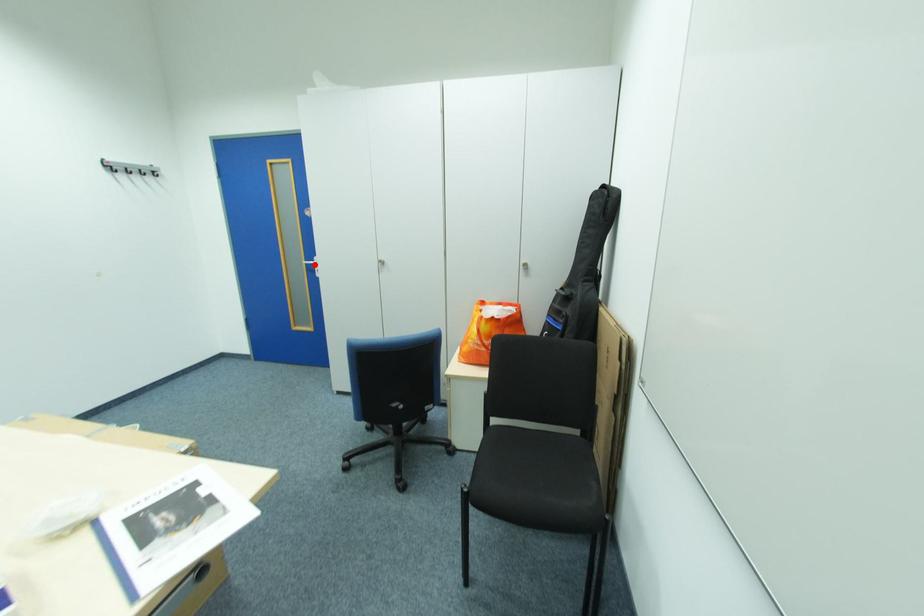
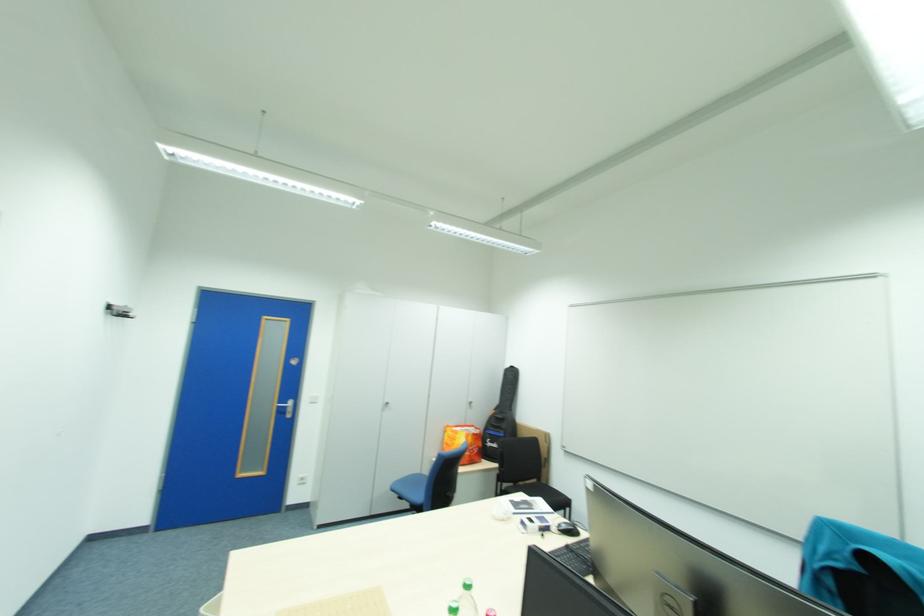
Locate, in the second image, the point that corresponds to the highlighted location in the first image.

(286, 407)